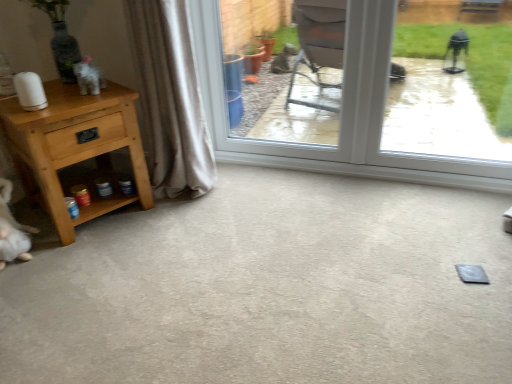
Question: From the image's perspective, is light brown wood nightstand at left located beneath beige fabric curtain at left?

Choices:
 (A) yes
 (B) no

Answer: (A)

Question: Is light brown wood nightstand at left smaller than beige fabric curtain at left?

Choices:
 (A) yes
 (B) no

Answer: (B)

Question: Is light brown wood nightstand at left far away from beige fabric curtain at left?

Choices:
 (A) no
 (B) yes

Answer: (A)

Question: Is light brown wood nightstand at left in contact with beige fabric curtain at left?

Choices:
 (A) yes
 (B) no

Answer: (B)

Question: Does light brown wood nightstand at left have a lesser width compared to beige fabric curtain at left?

Choices:
 (A) yes
 (B) no

Answer: (B)

Question: Is transparent glass window at center in front of or behind beige fabric curtain at left in the image?

Choices:
 (A) behind
 (B) front

Answer: (B)

Question: Would you say transparent glass window at center is inside or outside beige fabric curtain at left?

Choices:
 (A) outside
 (B) inside

Answer: (A)

Question: From a real-world perspective, is transparent glass window at center positioned above or below beige fabric curtain at left?

Choices:
 (A) above
 (B) below

Answer: (B)

Question: From their relative heights in the image, would you say transparent glass window at center is taller or shorter than beige fabric curtain at left?

Choices:
 (A) tall
 (B) short

Answer: (B)

Question: Is beige fabric curtain at left wider or thinner than transparent glass window at center?

Choices:
 (A) wide
 (B) thin

Answer: (A)

Question: Would you say beige fabric curtain at left is to the left or to the right of transparent glass window at center in the picture?

Choices:
 (A) left
 (B) right

Answer: (A)

Question: Choose the correct answer: Is beige fabric curtain at left inside transparent glass window at center or outside it?

Choices:
 (A) inside
 (B) outside

Answer: (B)

Question: Is beige fabric curtain at left taller or shorter than transparent glass window at center?

Choices:
 (A) tall
 (B) short

Answer: (A)

Question: Relative to white glossy elephant at upper left, is gray carpet at lower left in front or behind?

Choices:
 (A) behind
 (B) front

Answer: (B)

Question: Considering the positions of gray carpet at lower left and white glossy elephant at upper left in the image, is gray carpet at lower left bigger or smaller than white glossy elephant at upper left?

Choices:
 (A) small
 (B) big

Answer: (B)